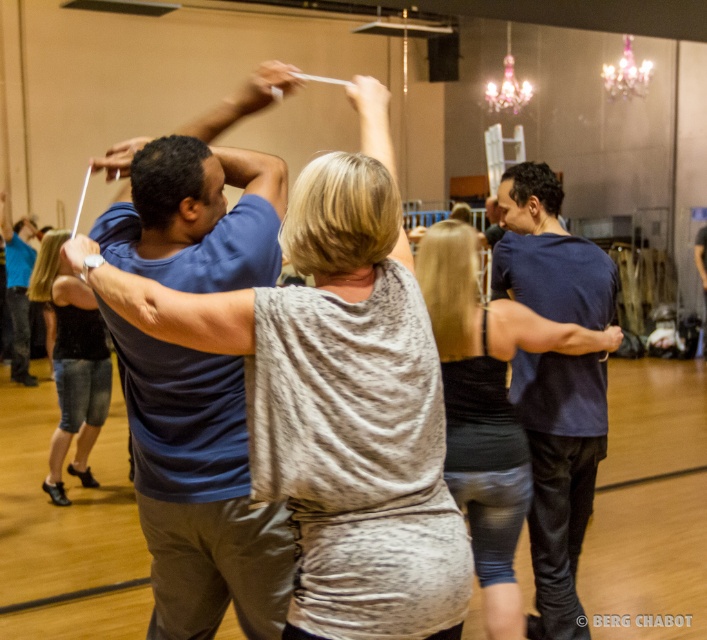
Does blue cotton shirt at center appear over dark blue shirt at center?

Yes, blue cotton shirt at center is above dark blue shirt at center.

Is point (117, 227) positioned in front of point (572, 442)?

Yes, it is in front of point (572, 442).

The image size is (707, 640). I want to click on blue cotton shirt at center, so click(x=199, y=490).

Between point (510, 186) and point (621, 52), which one is positioned in front?

Point (510, 186) is in front.

Is dark blue shirt at center positioned behind pink glass chandelier at upper center?

No, dark blue shirt at center is in front of pink glass chandelier at upper center.

Find the location of a particular element. dark blue shirt at center is located at coordinates 559,474.

Which is more to the left, dark blue shirt at center or blue denim jeans at lower left?

blue denim jeans at lower left

Between point (530, 634) and point (18, 340), which one is positioned in front?

Positioned in front is point (530, 634).

This screenshot has width=707, height=640. What are the coordinates of `dark blue shirt at center` in the screenshot? It's located at 559,474.